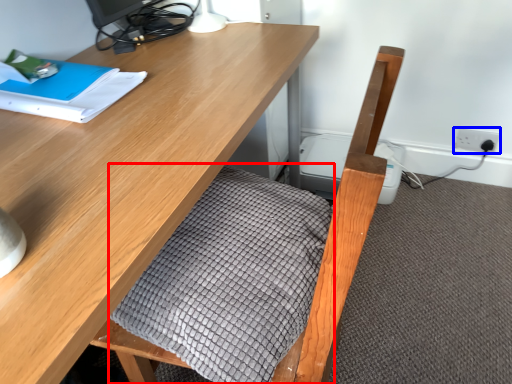
Question: Among these objects, which one is nearest to the camera, blanket (highlighted by a red box) or electric outlet (highlighted by a blue box)?

Choices:
 (A) blanket
 (B) electric outlet

Answer: (A)